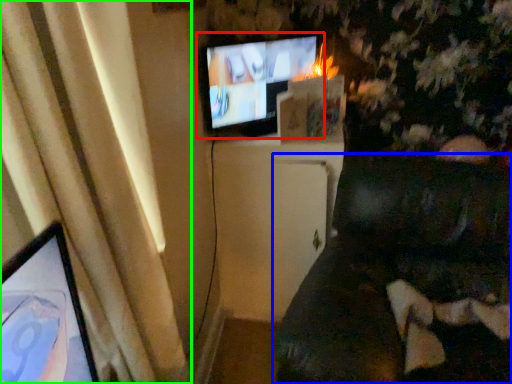
Question: Estimate the real-world distances between objects in this image. Which object is closer to television (highlighted by a red box), furniture (highlighted by a blue box) or curtain (highlighted by a green box)?

Choices:
 (A) furniture
 (B) curtain

Answer: (A)